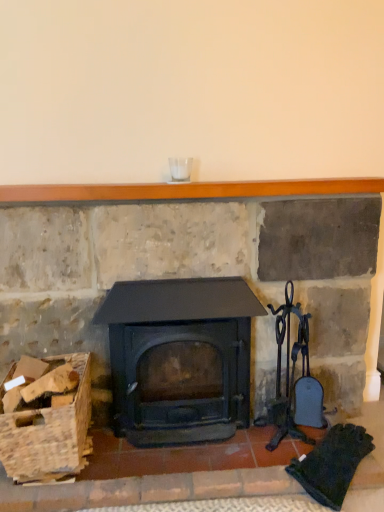
Question: Relative to matte black wood burning stove at center, is wooden crate at lower left in front or behind?

Choices:
 (A) behind
 (B) front

Answer: (B)

Question: Is wooden crate at lower left taller or shorter than matte black wood burning stove at center?

Choices:
 (A) tall
 (B) short

Answer: (B)

Question: Based on their relative distances, which object is nearer to the matte black wood burning stove at center?

Choices:
 (A) wooden mantlepiece at upper center
 (B) wooden crate at lower left

Answer: (B)

Question: Which object is positioned farthest from the wooden crate at lower left?

Choices:
 (A) wooden mantlepiece at upper center
 (B) matte black wood burning stove at center

Answer: (A)